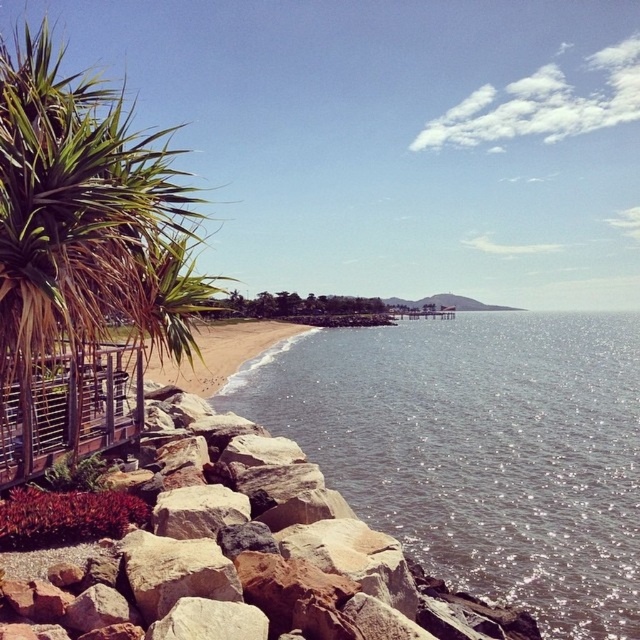
Image resolution: width=640 pixels, height=640 pixels. What do you see at coordinates (480, 451) in the screenshot?
I see `clear water at lower right` at bounding box center [480, 451].

Can you confirm if clear water at lower right is taller than green leafy palm tree at left?

No.

Locate an element on the screen. clear water at lower right is located at coordinates (480, 451).

Which is in front, point (144, 547) or point (12, 113)?

Point (12, 113) is more forward.

Does brown rough rock at lower left have a greater width compared to green leafy palm tree at left?

In fact, brown rough rock at lower left might be narrower than green leafy palm tree at left.

Does point (365, 605) lie behind point (161, 228)?

Yes, it is.

Locate an element on the screen. The image size is (640, 640). brown rough rock at lower left is located at coordinates (225, 550).

Is clear water at lower right to the left of brown rough rock at lower left from the viewer's perspective?

No, clear water at lower right is not to the left of brown rough rock at lower left.

Based on the photo, does clear water at lower right lie in front of brown rough rock at lower left?

No.

Does point (630, 339) lie behind point (115, 616)?

Yes, point (630, 339) is farther from viewer.

At what (x,y) coordinates should I click in order to perform the action: click on clear water at lower right. Please return your answer as a coordinate pair (x, y). Looking at the image, I should click on (480, 451).